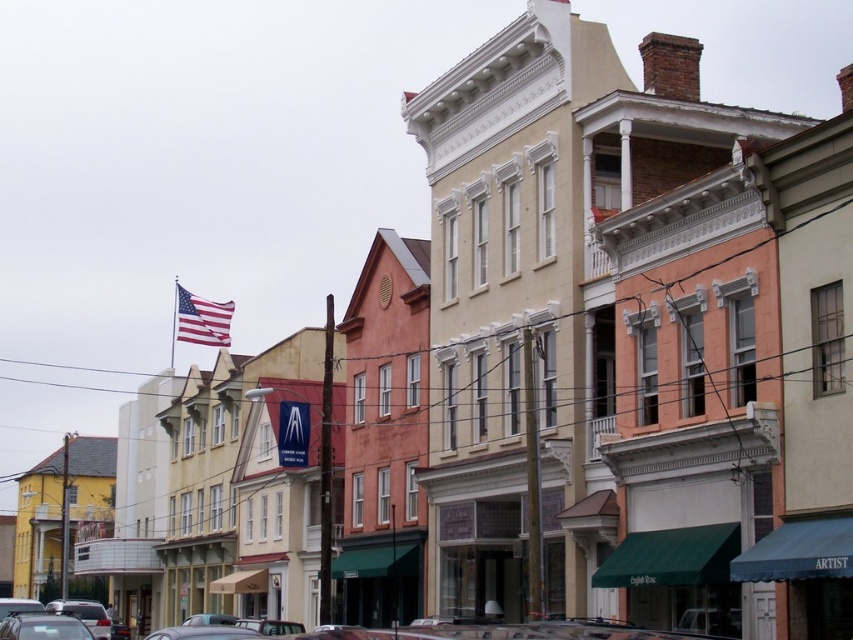
Which of these two, metallic silver car at lower center or american flag at upper center, stands shorter?

american flag at upper center

Can you confirm if metallic silver car at lower center is bigger than american flag at upper center?

No.

Where is `metallic silver car at lower center`? The image size is (853, 640). metallic silver car at lower center is located at coordinates (503, 632).

The image size is (853, 640). Find the location of `metallic silver car at lower center`. metallic silver car at lower center is located at coordinates (503, 632).